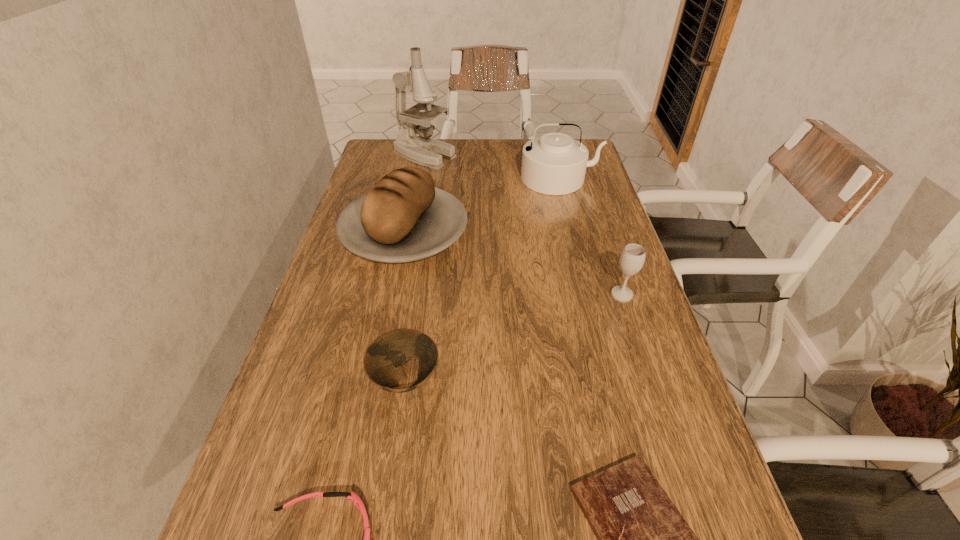
This screenshot has height=540, width=960. I want to click on the tallest object, so click(x=423, y=150).

Locate an element on the screen. Image resolution: width=960 pixels, height=540 pixels. kettle is located at coordinates (554, 164).

The image size is (960, 540). I want to click on bread, so click(403, 217).

The image size is (960, 540). In order to click on the fourth nearest object in this screenshot , I will do `click(632, 258)`.

Where is `wineglass`? Image resolution: width=960 pixels, height=540 pixels. wineglass is located at coordinates (632, 258).

Where is `bowl`? Image resolution: width=960 pixels, height=540 pixels. bowl is located at coordinates (383, 362).

Locate an element on the screen. the third shortest object is located at coordinates (383, 362).

Where is `free region located 0.210m on the front of the microscope`? This screenshot has height=540, width=960. free region located 0.210m on the front of the microscope is located at coordinates (415, 205).

At what (x,y) coordinates should I click in order to perform the action: click on vacant space located 0.110m on the spout of the kettle. Please return your answer as a coordinate pair (x, y). Looking at the image, I should click on (569, 217).

Where is `vacant area located 0.380m on the back of the fifth nearest object`? Image resolution: width=960 pixels, height=540 pixels. vacant area located 0.380m on the back of the fifth nearest object is located at coordinates point(423,141).